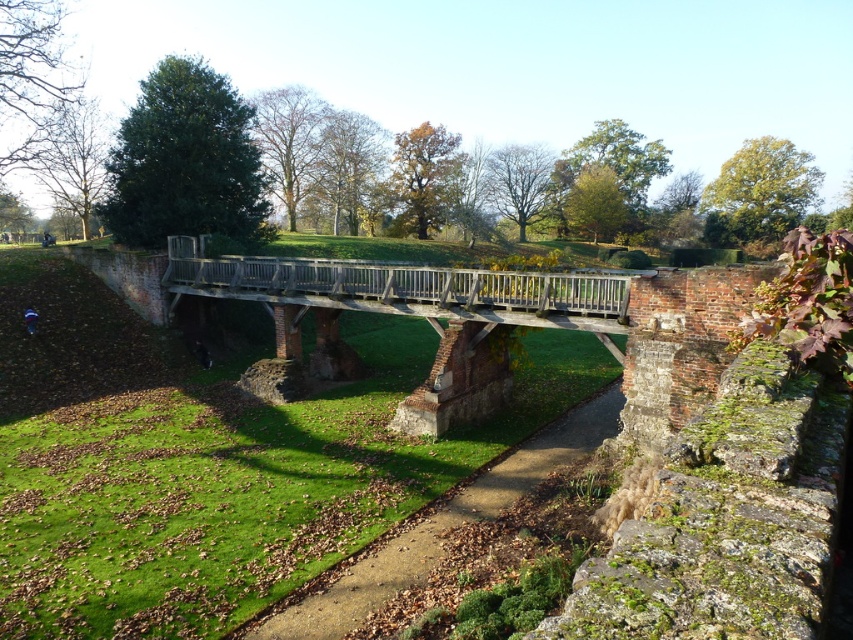
Question: Where is wooden bridge at center located in relation to brown dirt path at lower center in the image?

Choices:
 (A) left
 (B) right

Answer: (A)

Question: Which object is closer to the camera taking this photo?

Choices:
 (A) brown dirt path at lower center
 (B) wooden bridge at center

Answer: (A)

Question: Can you confirm if wooden bridge at center is bigger than brown dirt path at lower center?

Choices:
 (A) yes
 (B) no

Answer: (A)

Question: Is wooden bridge at center wider than brown dirt path at lower center?

Choices:
 (A) yes
 (B) no

Answer: (A)